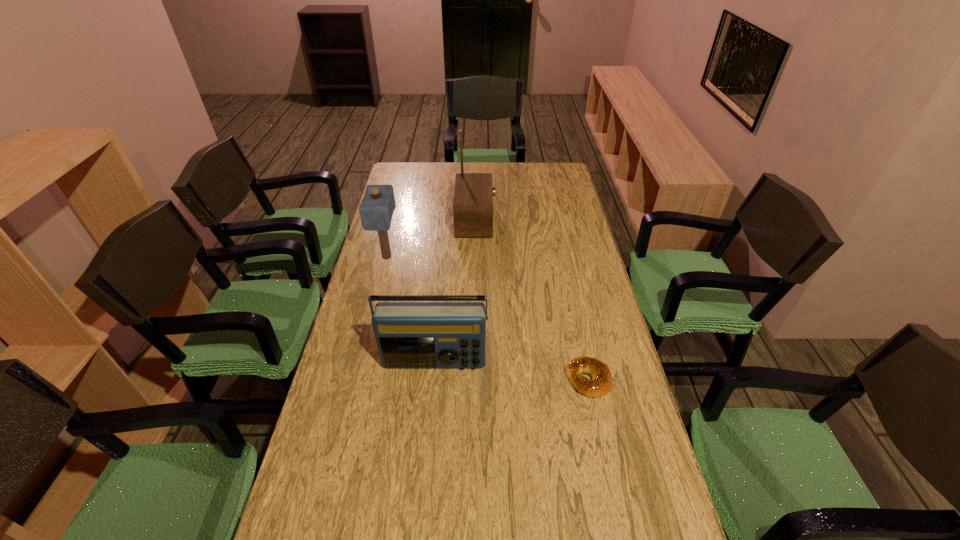
The width and height of the screenshot is (960, 540). What are the coordinates of `vacant space situated 0.100m on the left of the shortest object` in the screenshot? It's located at (531, 379).

The image size is (960, 540). I want to click on mallet positioned at the left edge, so click(x=376, y=209).

Find the location of a particular element. Image resolution: width=960 pixels, height=540 pixels. radio receiver located at the left edge is located at coordinates (408, 334).

At what (x,y) coordinates should I click in order to perform the action: click on object positioned at the right edge. Please return your answer as a coordinate pair (x, y). This screenshot has width=960, height=540. Looking at the image, I should click on (601, 383).

I want to click on vacant area at the far edge of the desktop, so click(468, 166).

In the image, there is a desktop. At what (x,y) coordinates should I click in order to perform the action: click on vacant space at the left edge. Please return your answer as a coordinate pair (x, y). The height and width of the screenshot is (540, 960). Looking at the image, I should click on (413, 207).

The height and width of the screenshot is (540, 960). I want to click on vacant space at the right edge of the desktop, so click(588, 289).

The width and height of the screenshot is (960, 540). Find the location of `blank space at the far right corner`. blank space at the far right corner is located at coordinates (569, 183).

Locate an element on the screen. The height and width of the screenshot is (540, 960). empty location between the rightmost object and the nearer radio receiver is located at coordinates (512, 370).

You are a GUI agent. You are given a task and a screenshot of the screen. Output one action in this format:
    pyautogui.click(x=<x>, y=<y>)
    Task: Click on the vacant space that is in between the bagel and the taller radio receiver
    The image size is (960, 540).
    Given the screenshot: What is the action you would take?
    pyautogui.click(x=532, y=300)